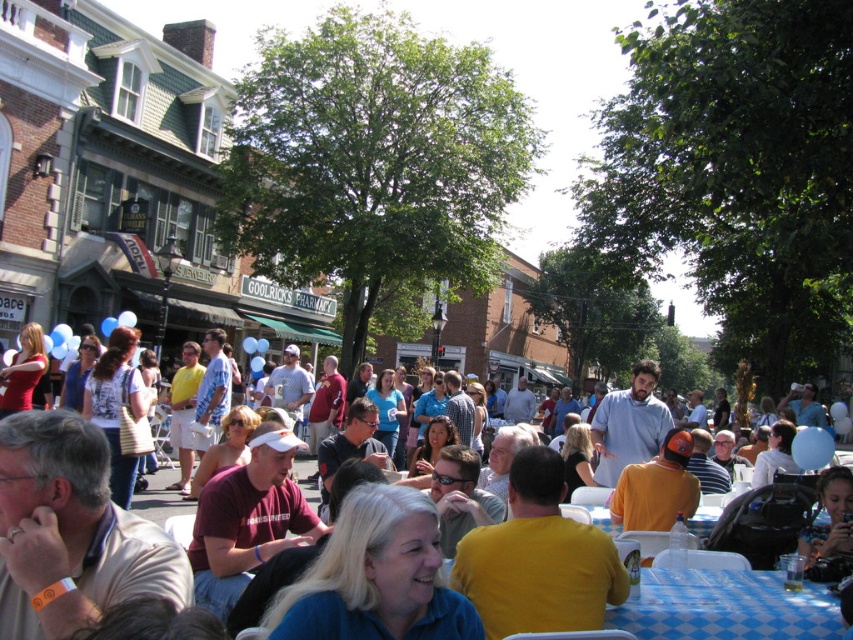
You are standing at the center of the image and see a point marked at coordinates [726,608]. Which object is this point located on?

The point at coordinates [726,608] is located on the yellow t shirt at center.